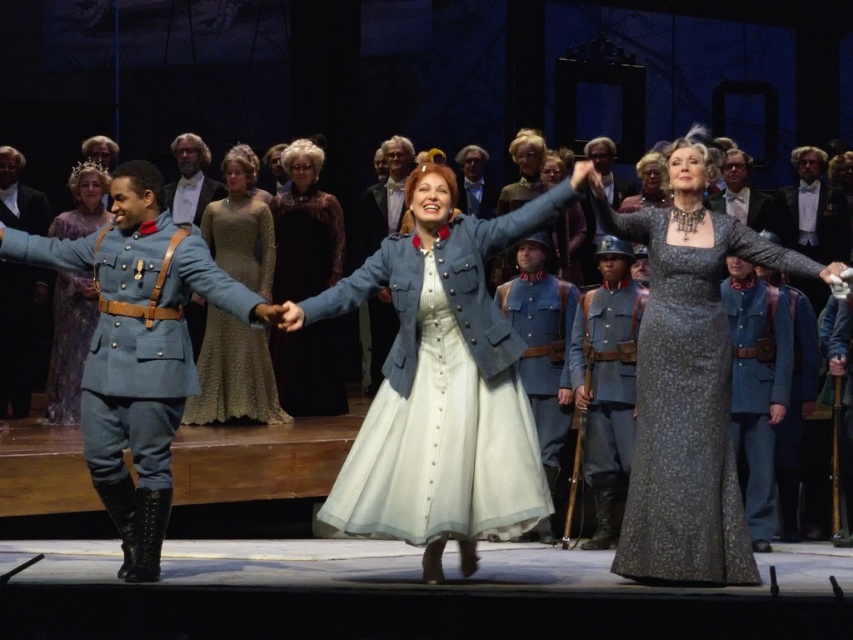
Is denim uniform at center thinner than light blue fabric uniform at center?

Yes.

Can you confirm if denim uniform at center is bigger than light blue fabric uniform at center?

Correct, denim uniform at center is larger in size than light blue fabric uniform at center.

Is point (549, 538) positioned in front of point (200, 150)?

Yes, point (549, 538) is in front of point (200, 150).

The width and height of the screenshot is (853, 640). I want to click on denim uniform at center, so click(x=543, y=342).

Which is behind, point (294, 403) or point (376, 193)?

The point (376, 193) is more distant.

Is velvet burgundy dress at center smaller than matte blue jacket at center?

Yes.

I want to click on velvet burgundy dress at center, so click(x=305, y=228).

Where is `velvet burgundy dress at center`? The width and height of the screenshot is (853, 640). velvet burgundy dress at center is located at coordinates (305, 228).

Between point (619, 420) and point (6, 385), which one is positioned in front?

Positioned in front is point (619, 420).

Can you confirm if matte gray uniform at center is taller than black leather jacket at left?

Yes.

Describe the element at coordinates (606, 378) in the screenshot. Image resolution: width=853 pixels, height=640 pixels. I see `matte gray uniform at center` at that location.

You are a GUI agent. You are given a task and a screenshot of the screen. Output one action in this format:
    pyautogui.click(x=<x>, y=<y>)
    Task: Click on the matte gray uniform at center
    
    Given the screenshot: What is the action you would take?
    pyautogui.click(x=606, y=378)